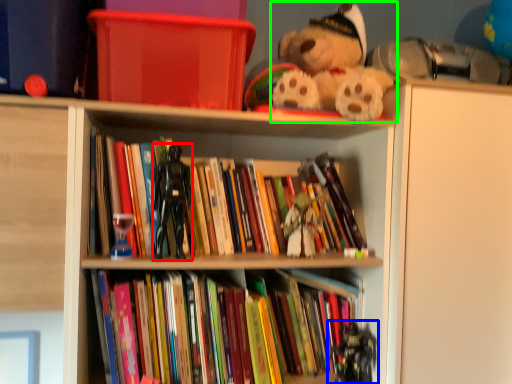
Question: Which object is positioned farthest from miniature (highlighted by a red box)? Select from toy (highlighted by a blue box) and teddy bear (highlighted by a green box).

Choices:
 (A) toy
 (B) teddy bear

Answer: (A)